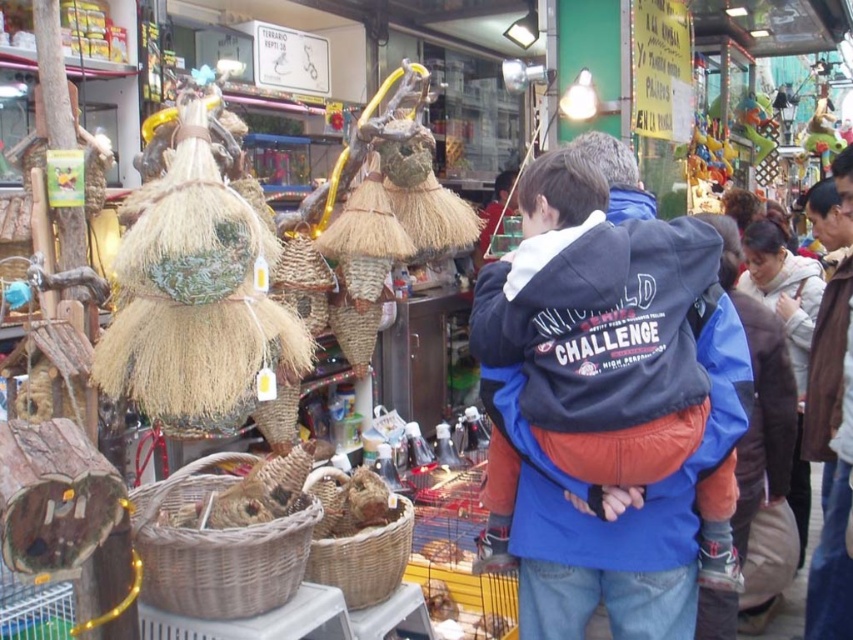
Can you confirm if blue fleece jacket at center is positioned to the right of woven brown basket at lower center?

Yes, blue fleece jacket at center is to the right of woven brown basket at lower center.

Who is more forward, (670, 632) or (360, 576)?

Point (670, 632) is more forward.

The image size is (853, 640). What do you see at coordinates (599, 410) in the screenshot?
I see `blue fleece jacket at center` at bounding box center [599, 410].

At what (x,y) coordinates should I click in order to perform the action: click on blue fleece jacket at center. Please return your answer as a coordinate pair (x, y). Looking at the image, I should click on (599, 410).

You are a GUI agent. You are given a task and a screenshot of the screen. Output one action in this format:
    pyautogui.click(x=<x>, y=<y>)
    Task: Click on the woven brown basket at center
    This screenshot has width=853, height=640.
    Given the screenshot: What is the action you would take?
    point(216,547)

Does woven brown basket at center have a smaller size compared to woven brown basket at lower center?

No, woven brown basket at center is not smaller than woven brown basket at lower center.

The height and width of the screenshot is (640, 853). I want to click on woven brown basket at center, so click(216, 547).

Which of these two, blue fleece jacket at center or woven brown basket at center, stands shorter?

woven brown basket at center

Between point (619, 266) and point (186, 465), which one is positioned in front?

Positioned in front is point (619, 266).

At what (x,y) coordinates should I click in order to perform the action: click on blue fleece jacket at center. Please return your answer as a coordinate pair (x, y). This screenshot has width=853, height=640. Looking at the image, I should click on (599, 410).